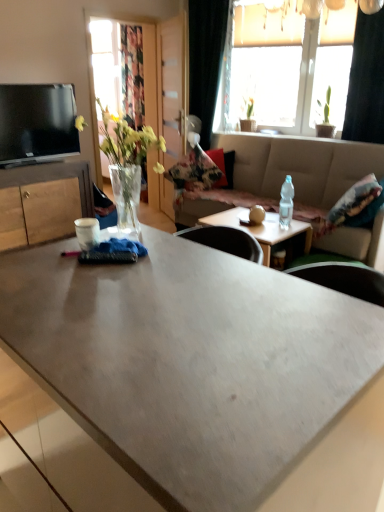
Find the location of `space that is in front of clear glass vase at left`. space that is in front of clear glass vase at left is located at coordinates (130, 256).